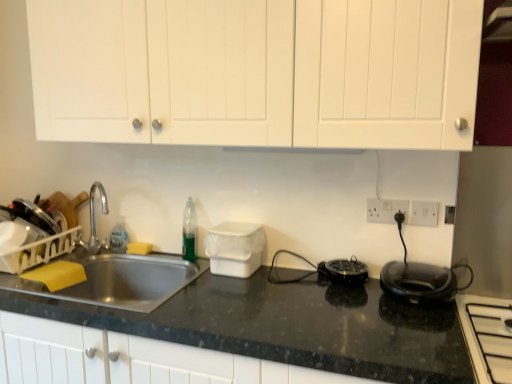
Image resolution: width=512 pixels, height=384 pixels. Find the location of `free spot in front of black plastic appliance at center, the second appliance in the left-to-right sequence`. free spot in front of black plastic appliance at center, the second appliance in the left-to-right sequence is located at coordinates (358, 311).